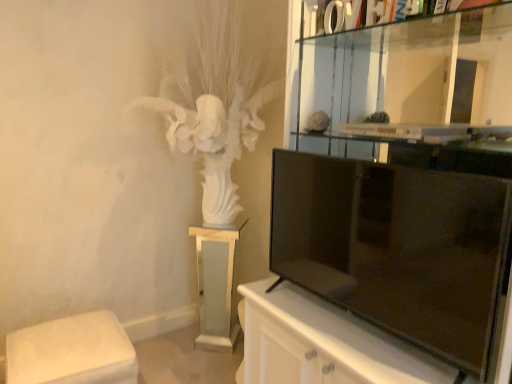
Question: Is point (81, 322) closer or farther from the camera than point (204, 241)?

Choices:
 (A) farther
 (B) closer

Answer: (B)

Question: Considering the positions of white fabric ottoman at lower left, arranged as the second furniture when viewed from the back, and white frosted glass pedestal at center, which is the 1th furniture from back to front, in the image, is white fabric ottoman at lower left, arranged as the second furniture when viewed from the back, bigger or smaller than white frosted glass pedestal at center, which is the 1th furniture from back to front,?

Choices:
 (A) big
 (B) small

Answer: (A)

Question: Considering the real-world distances, which object is closest to the black glossy tv at right?

Choices:
 (A) white frosted glass pedestal at center, which is the 2th furniture in left-to-right order
 (B) white fabric ottoman at lower left, arranged as the second furniture when viewed from the back

Answer: (A)

Question: Which is nearer to the white fabric ottoman at lower left, the 2th furniture when ordered from right to left?

Choices:
 (A) white frosted glass pedestal at center, the 1th furniture positioned from the right
 (B) black glossy tv at right

Answer: (A)